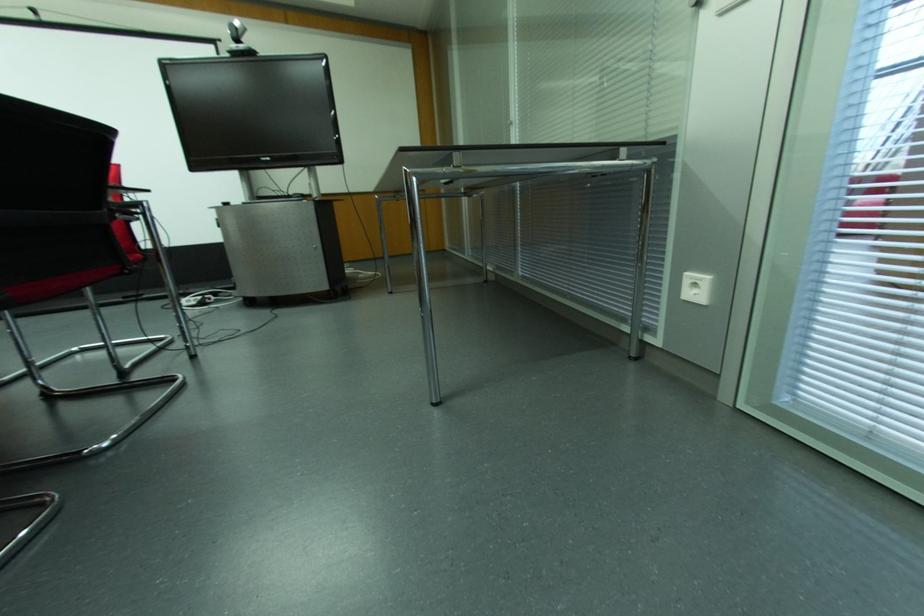
Find where to reposition the small webcam. Please return your answer as a coordinate pair (x, y).

(236, 31)